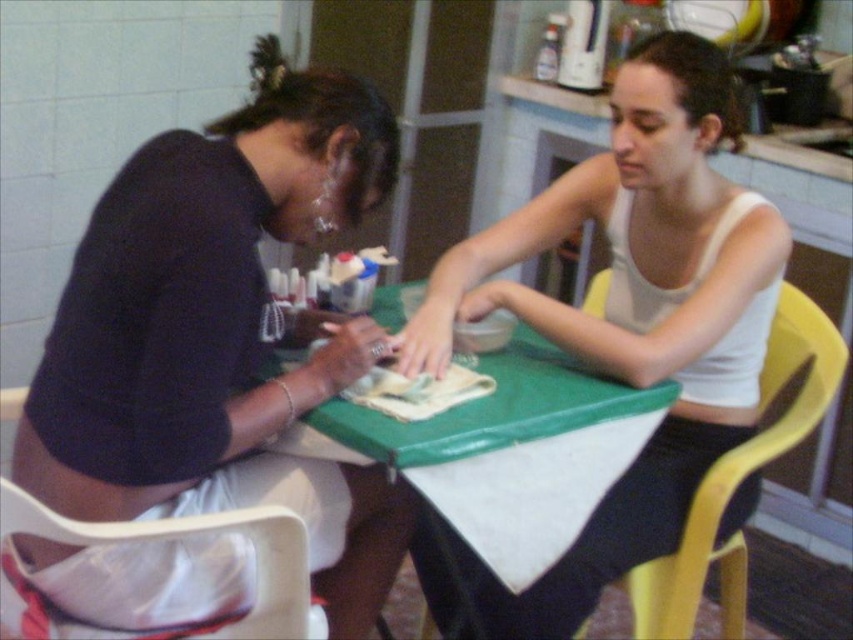
Question: Based on their relative distances, which object is farther from the plastic bag at lower left?

Choices:
 (A) yellow plastic chair at right
 (B) white matte tank top at center

Answer: (A)

Question: Which of the following is the farthest from the observer?

Choices:
 (A) yellow plastic chair at right
 (B) white matte tank top at center

Answer: (A)

Question: Can you confirm if green plastic table at center is positioned to the right of plastic bag at lower left?

Choices:
 (A) yes
 (B) no

Answer: (A)

Question: Can you confirm if white matte tank top at center is positioned to the left of yellow plastic chair at right?

Choices:
 (A) yes
 (B) no

Answer: (A)

Question: Among these points, which one is nearest to the camera?

Choices:
 (A) (113, 529)
 (B) (642, 195)
 (C) (552, 385)

Answer: (A)

Question: Is yellow plastic chair at right wider than plastic bag at lower left?

Choices:
 (A) no
 (B) yes

Answer: (B)